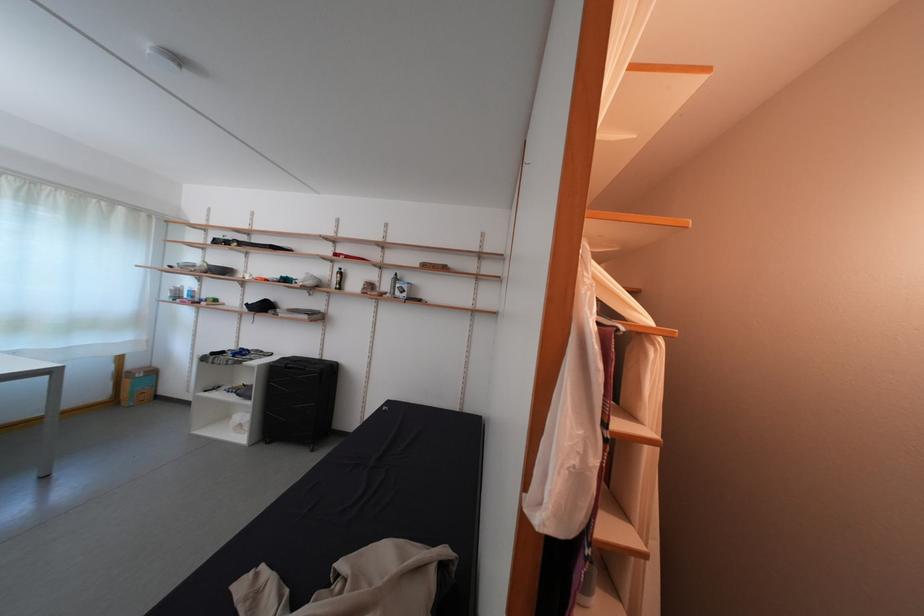
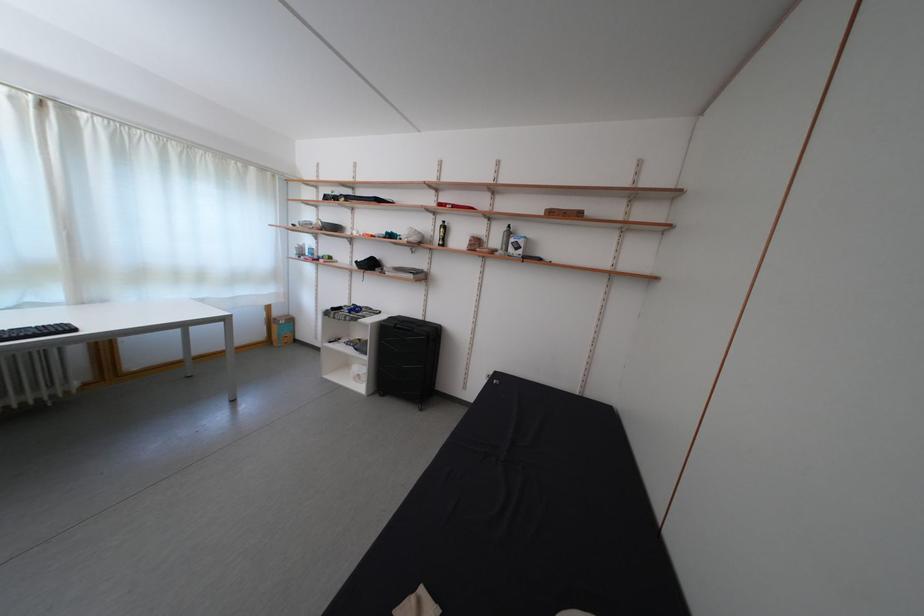
Where in the second image is the point corresponding to [140,371] from the first image?

(285, 320)